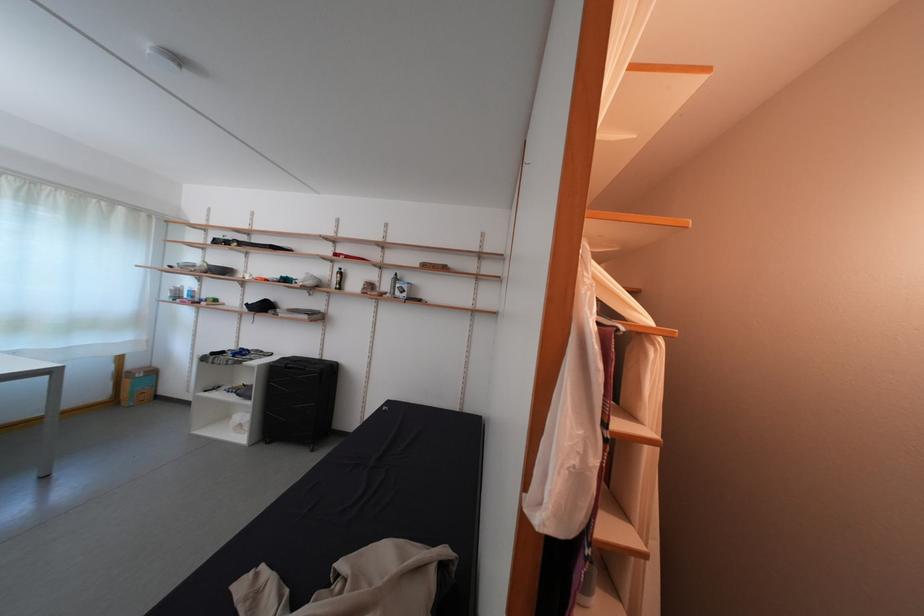
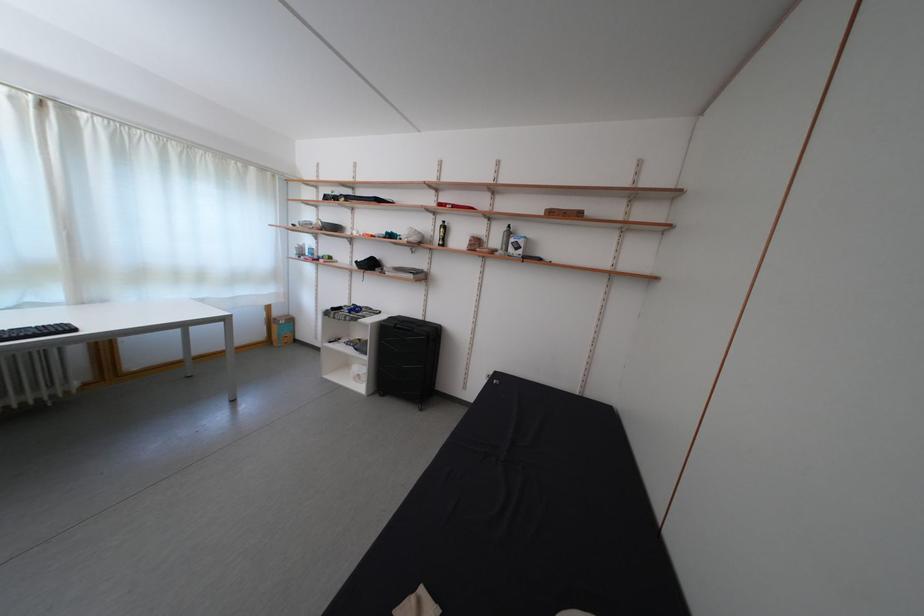
Where in the second image is the point corresponding to [140,371] from the first image?

(285, 320)